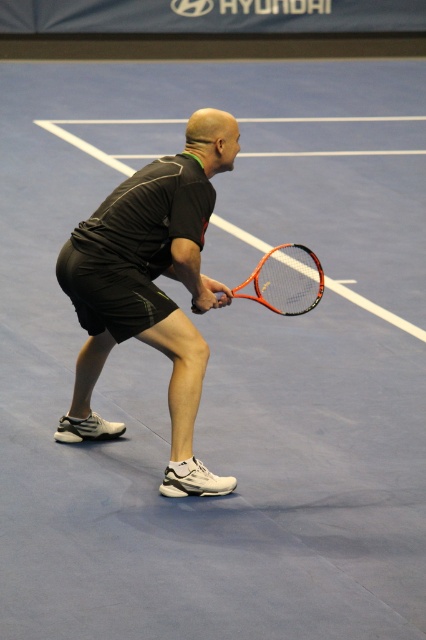
Question: Which point is farther to the camera?

Choices:
 (A) [294, 275]
 (B) [141, 224]

Answer: (A)

Question: Is black matte tennis racket at center positioned behind orange carbon fiber tennis racket at center?

Choices:
 (A) no
 (B) yes

Answer: (A)

Question: Among these points, which one is farthest from the camera?

Choices:
 (A) (247, 294)
 (B) (192, 289)

Answer: (A)

Question: Can you confirm if black matte tennis racket at center is smaller than orange carbon fiber tennis racket at center?

Choices:
 (A) yes
 (B) no

Answer: (B)

Question: Does black matte tennis racket at center appear on the right side of orange carbon fiber tennis racket at center?

Choices:
 (A) yes
 (B) no

Answer: (B)